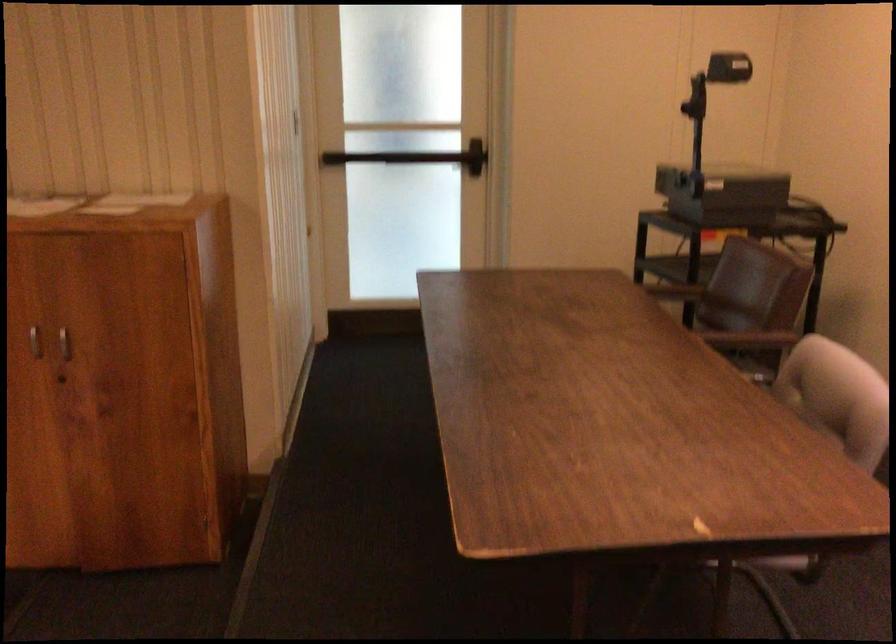
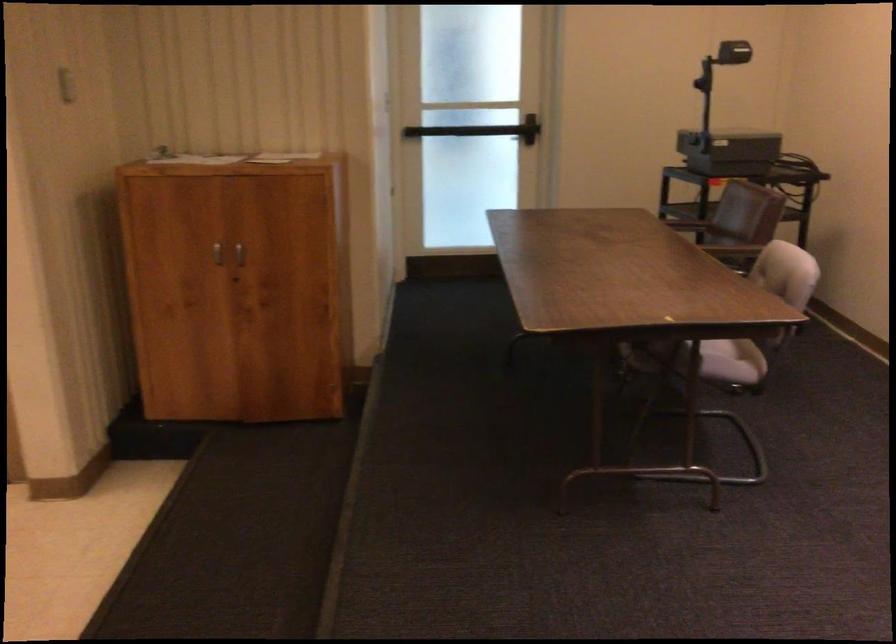
Find the pixel in the second image that matches [418,158] in the first image.

(479, 129)